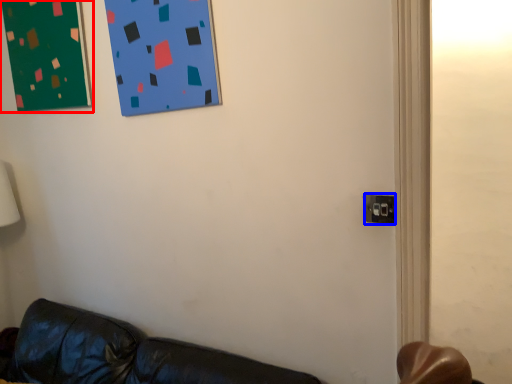
Question: Which point is further to the camera, bulletin board (highlighted by a red box) or electric outlet (highlighted by a blue box)?

Choices:
 (A) bulletin board
 (B) electric outlet

Answer: (A)